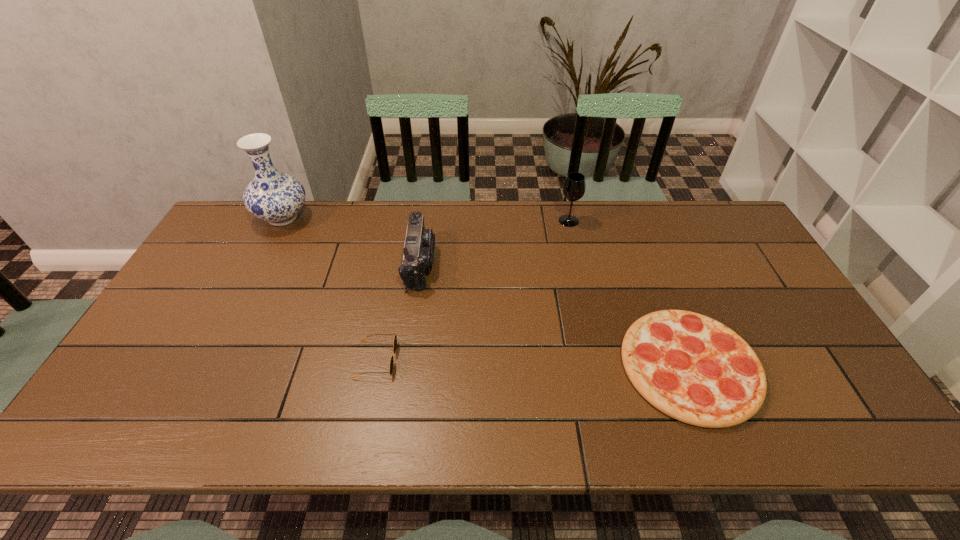
This screenshot has width=960, height=540. Find the location of `vacant space at the near edge of the desktop`. vacant space at the near edge of the desktop is located at coordinates (284, 404).

Locate an element on the screen. This screenshot has width=960, height=540. free point at the left edge is located at coordinates (146, 374).

Identify the location of free space at the right edge. (746, 272).

Find the location of a particular element. The height and width of the screenshot is (540, 960). vacant space at the near left corner of the desktop is located at coordinates (142, 420).

Where is `empty space that is in between the fourth tallest object and the wineglass`? The height and width of the screenshot is (540, 960). empty space that is in between the fourth tallest object and the wineglass is located at coordinates (472, 290).

Locate an element on the screen. This screenshot has width=960, height=540. free spot between the wineglass and the second shortest object is located at coordinates (472, 290).

Image resolution: width=960 pixels, height=540 pixels. I want to click on free space between the tallest object and the third farthest object, so click(x=351, y=240).

The width and height of the screenshot is (960, 540). What are the coordinates of `free space between the sunglasses and the wineglass` in the screenshot? It's located at (472, 290).

You are a GUI agent. You are given a task and a screenshot of the screen. Output one action in this format:
    pyautogui.click(x=<x>, y=<y>)
    Task: Click on the free spot between the wineglass and the leftmost object
    The image size is (960, 540).
    Given the screenshot: What is the action you would take?
    pyautogui.click(x=426, y=219)

Identify the location of free space that is in between the camcorder and the tallest object. Image resolution: width=960 pixels, height=540 pixels. click(351, 240).